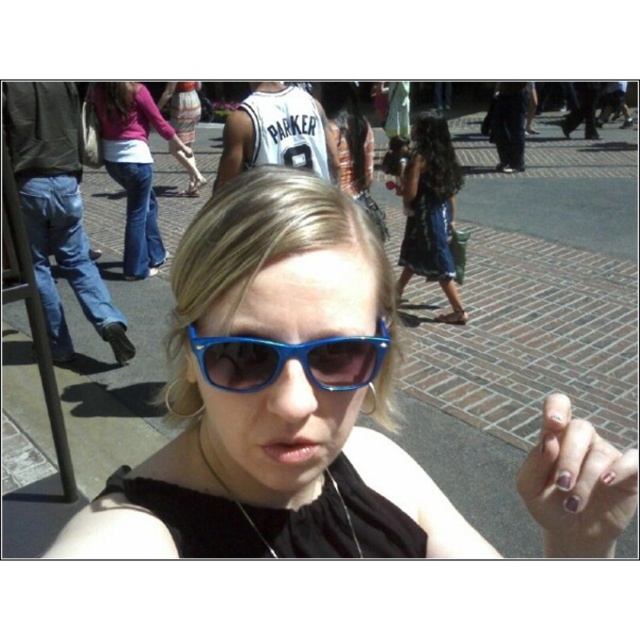
Question: Is shiny blue sunglasses at center closer to camera compared to blue plastic sunglasses at center?

Choices:
 (A) yes
 (B) no

Answer: (A)

Question: Which point is closer to the camera?

Choices:
 (A) blue denim jeans at center
 (B) jeans at center

Answer: (A)

Question: Is the position of purple painted nails at center less distant than that of jeans at center?

Choices:
 (A) yes
 (B) no

Answer: (A)

Question: Which of the following is the closest to the observer?

Choices:
 (A) jeans at center
 (B) shiny blue sunglasses at center

Answer: (B)

Question: Among these objects, which one is farthest from the camera?

Choices:
 (A) blue plastic sunglasses at center
 (B) jeans at left

Answer: (B)

Question: In this image, where is shiny blue sunglasses at center located relative to jeans at center?

Choices:
 (A) above
 (B) below

Answer: (B)